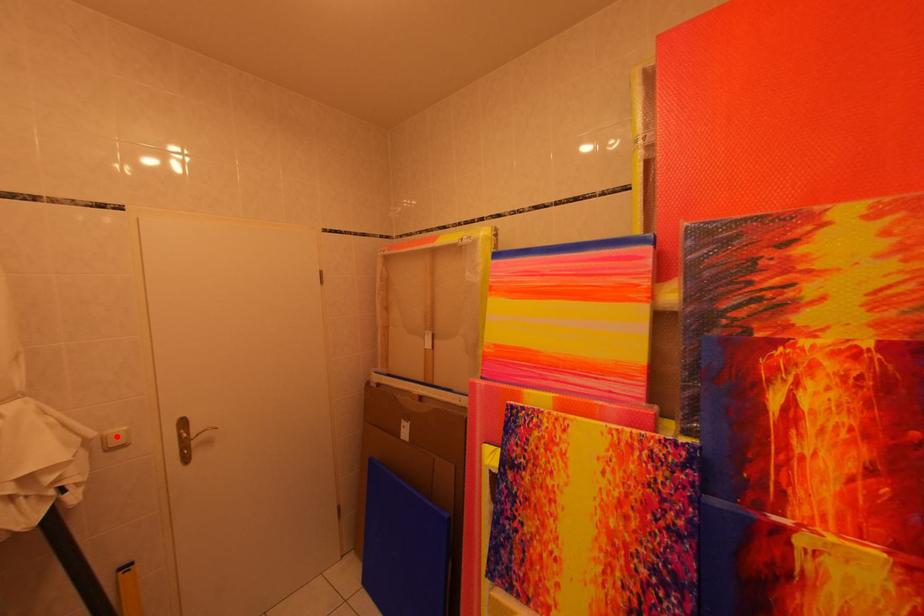
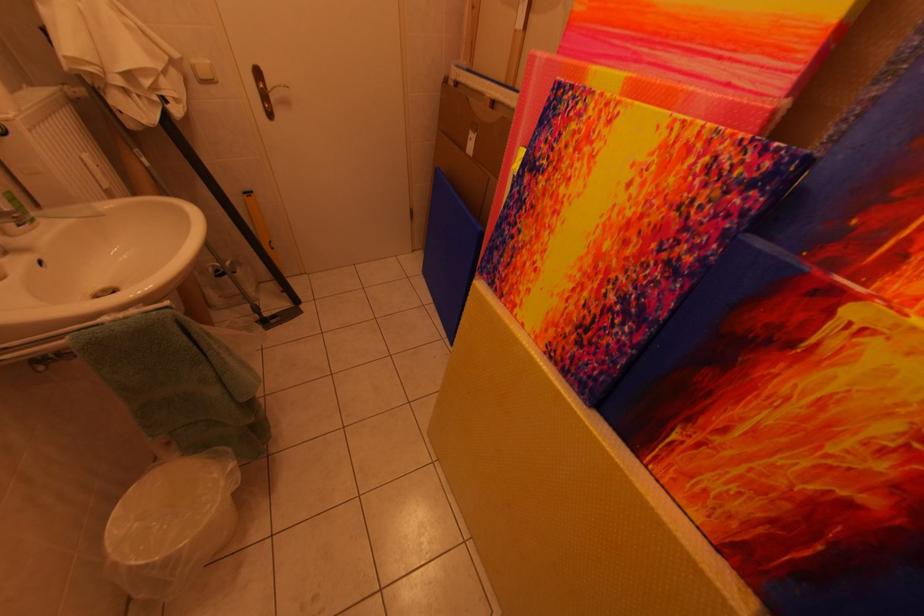
In the second image, find the point that corresponds to the highlighted location in the first image.

(203, 65)